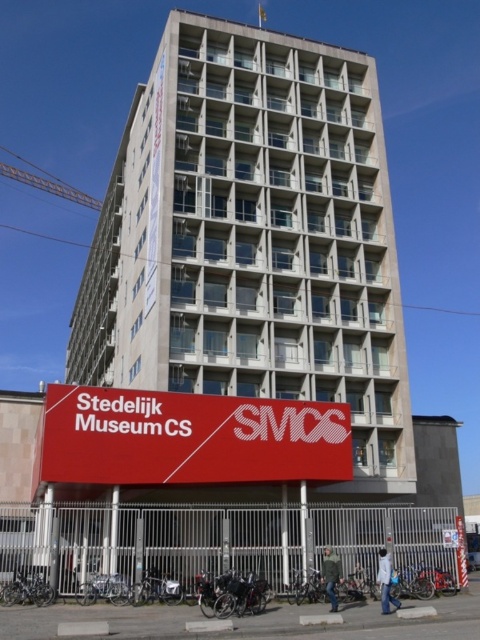
You are standing in front of the Stedelijk Museum CS and want to take a photo that includes both the concrete building at center and the red matte sign at lower center. Which object should you focus on first to ensure both are in frame?

You should focus on the concrete building at center first because it is much taller than the red matte sign at lower center, so adjusting the camera angle to include its full height will naturally include the smaller sign in the foreground.

You are a photographer planning to capture the entire structure of the concrete building at center and the red matte sign at lower center in a single frame. Based on the scene description, which object would appear wider in the photograph?

The concrete building at center would appear wider in the photograph since its width surpasses that of the red matte sign at lower center according to the description.

You are standing in front of the Stedelijk Museum CS and want to take a photo of both the point at coordinates (x=300, y=342) and the point at coordinates (x=207, y=465). Which point should you focus on first to ensure both are in the frame?

You should focus on the point at coordinates (x=207, y=465) first because it is closer to you than the point at coordinates (x=300, y=342), which is further away. This way, both points will be included in the photo.